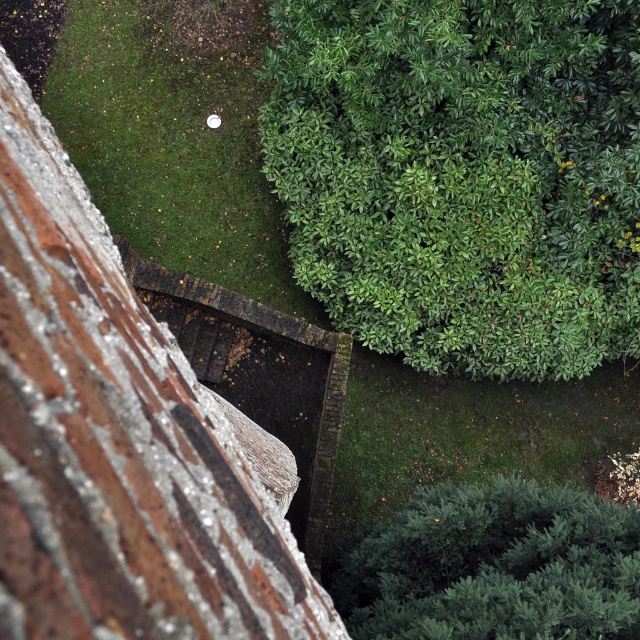
Is point (125, 518) farther from viewer compared to point (433, 528)?

No, it is in front of (433, 528).

Measure the distance between smooth brick wall at center and camera.

smooth brick wall at center is 5.78 feet from camera.

At what (x,y) coordinates should I click in order to perform the action: click on smooth brick wall at center. Please return your answer as a coordinate pair (x, y). Image resolution: width=640 pixels, height=640 pixels. Looking at the image, I should click on (116, 440).

Is green leafy bush at upper right wider than smooth brick wall at center?

Correct, the width of green leafy bush at upper right exceeds that of smooth brick wall at center.

Between point (600, 113) and point (189, 445), which one is positioned in front?

Point (189, 445)

Locate an element on the screen. Image resolution: width=640 pixels, height=640 pixels. green leafy bush at upper right is located at coordinates (464, 177).

Between point (387, 132) and point (376, 564), which one is positioned in front?

Positioned in front is point (376, 564).

Is point (483, 362) closer to viewer compared to point (440, 627)?

That is False.

Is point (609, 292) closer to camera compared to point (582, 634)?

No, (609, 292) is further to viewer.

This screenshot has width=640, height=640. Identify the location of green leafy bush at upper right. (464, 177).